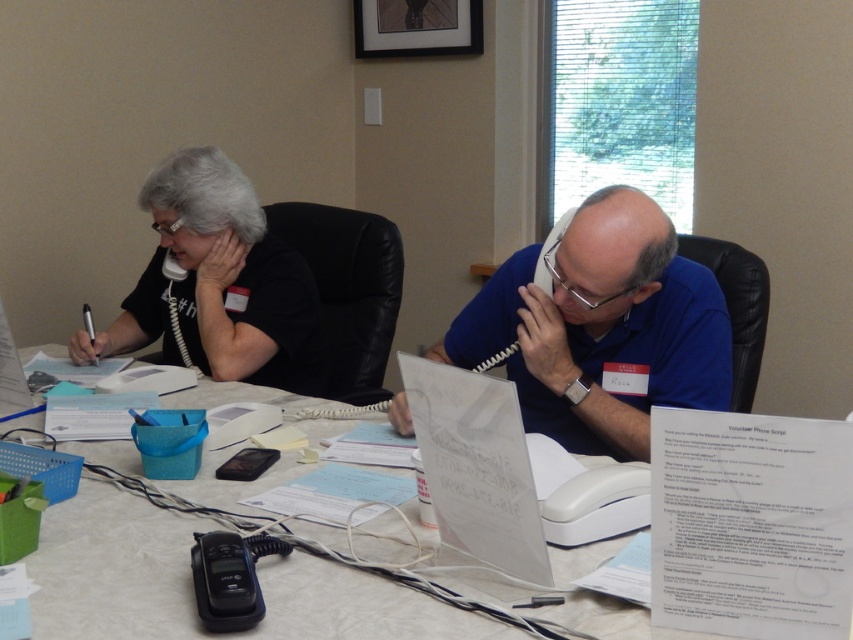
Locate an element on the screen. blue fabric shirt at center is located at coordinates (602, 326).

Consider the image. Between blue fabric shirt at center and black matte shirt at upper left, which one has less height?

With less height is blue fabric shirt at center.

Is point (721, 317) positioned behind point (234, 236)?

No, (721, 317) is in front of (234, 236).

In order to click on blue fabric shirt at center in this screenshot , I will do `click(602, 326)`.

Who is lower down, white paper at center or blue fabric shirt at center?

white paper at center is below.

Who is more distant from viewer, (x=625, y=618) or (x=550, y=339)?

Point (x=550, y=339)

Where is `white paper at center`? The width and height of the screenshot is (853, 640). white paper at center is located at coordinates (749, 520).

Who is more forward, [428,461] or [589,369]?

Positioned in front is point [428,461].

Describe the element at coordinates (749, 520) in the screenshot. This screenshot has width=853, height=640. I see `white paper at center` at that location.

Where is `white paper at center`? white paper at center is located at coordinates (749, 520).